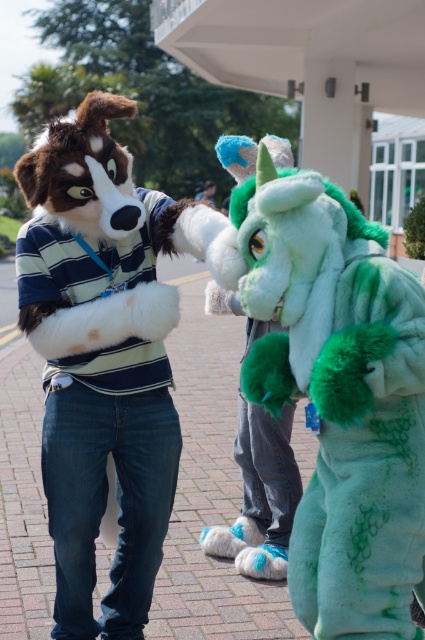
Based on the photo, you are a photographer trying to capture a group photo of the green fuzzy dragon at center and the fuzzy white dog at center. The camera you are using has a minimum focus distance of 30 inches. Will you be able to take a clear photo of both subjects at the same time?

The green fuzzy dragon at center and the fuzzy white dog at center are 28.71 inches apart. Since the camera has a minimum focus distance of 30 inches, you will not be able to take a clear photo of both subjects at the same time because they are closer than the required distance.

You are a photographer trying to capture a photo of both the green fuzzy dragon at center and the fuzzy white dog at center. Since you want to ensure both are fully visible in the frame, which character should you position closer to the camera to avoid cropping?

The green fuzzy dragon at center is shorter than the fuzzy white dog at center, so positioning the green fuzzy dragon at center closer to the camera will ensure both are fully visible without cropping.